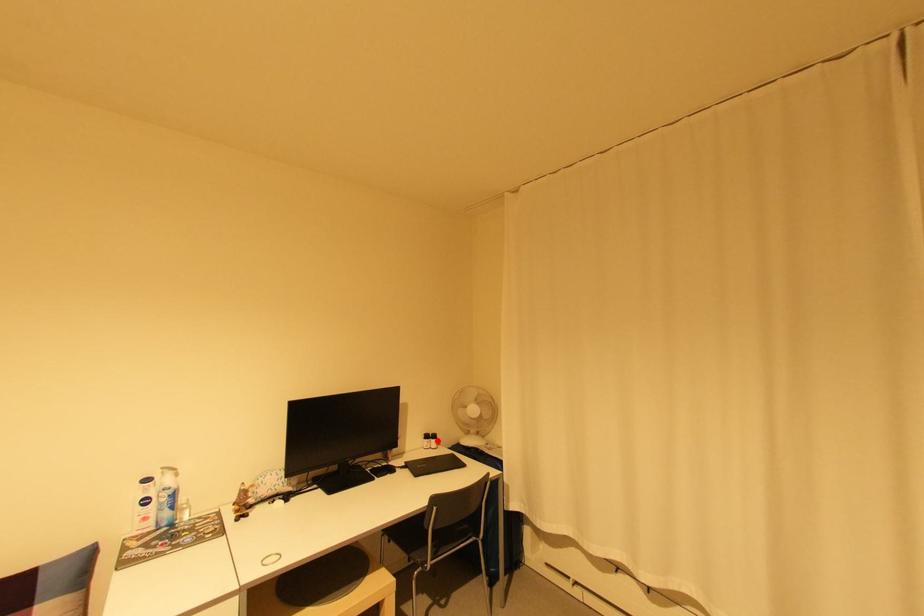
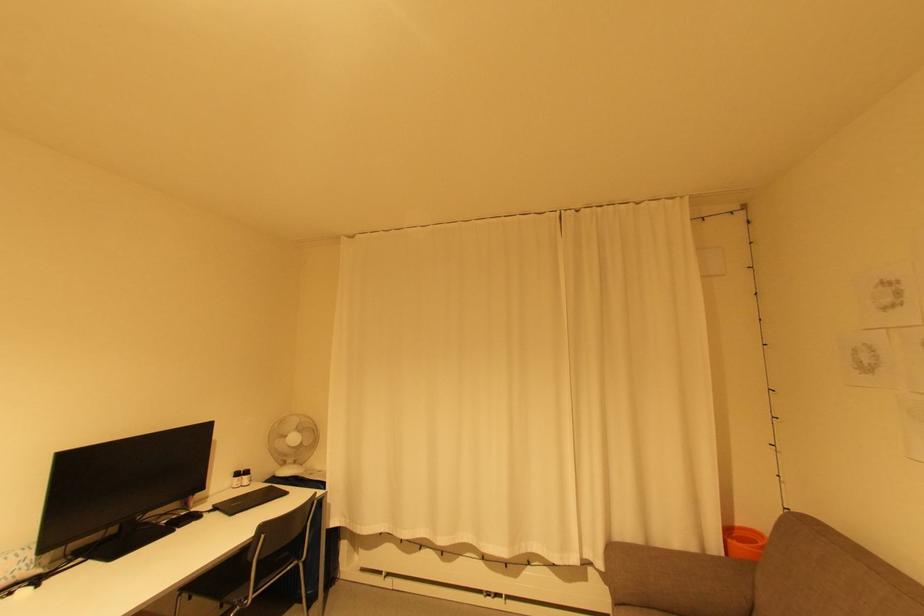
Locate, in the second image, the point that corresponds to the highlighted location in the first image.

(250, 477)